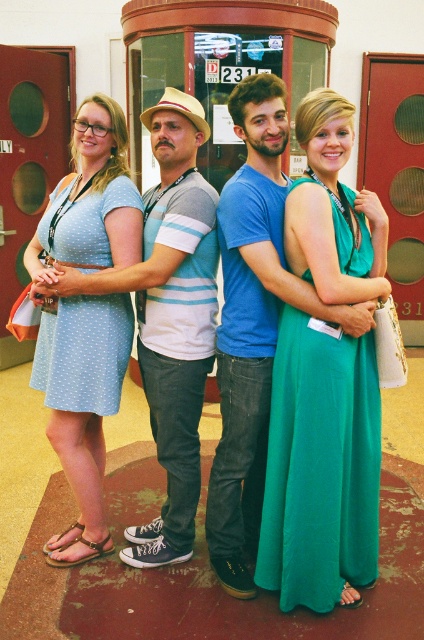
Question: Which point is farther from the camera taking this photo?

Choices:
 (A) (279, 554)
 (B) (44, 273)
 (C) (52, 336)

Answer: (C)

Question: Which point is farther to the camera?

Choices:
 (A) (49, 252)
 (B) (80, 236)
 (C) (357, 250)

Answer: (A)

Question: Can you confirm if emerald green satin dress at center is thinner than light blue dotted dress at left?

Choices:
 (A) yes
 (B) no

Answer: (A)

Question: Can you confirm if emerald green satin dress at center is positioned to the right of light blue dotted fabric dress at left?

Choices:
 (A) no
 (B) yes

Answer: (B)

Question: Which object is farther from the camera taking this photo?

Choices:
 (A) light blue dotted dress at left
 (B) emerald green satin dress at center

Answer: (A)

Question: Can you confirm if emerald green satin dress at center is positioned to the right of light blue dotted fabric dress at left?

Choices:
 (A) no
 (B) yes

Answer: (B)